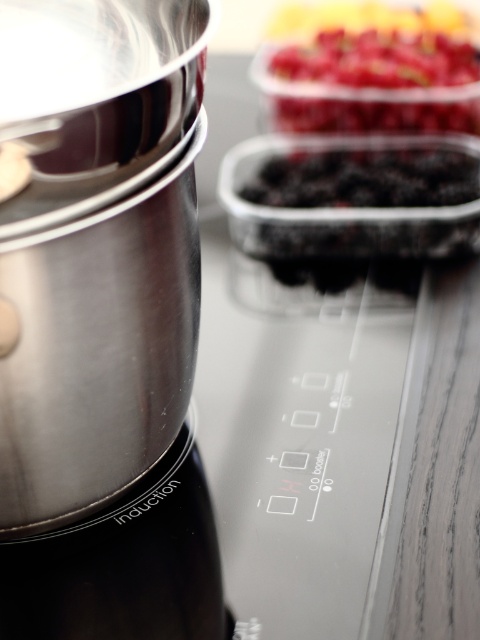
You are a chef preparing a dessert and need to access both the polished metal mixer at left and the glossy plastic berries at upper center. Based on their positions, which object would you need to reach down lower to retrieve?

The polished metal mixer at left is located below the glossy plastic berries at upper center, so you would need to reach down lower to get the polished metal mixer at left.

You are a chef preparing a dessert and need to know which tool to use first. The polished metal mixer at left and the glossy plastic berries at upper center are both on the counter. Which one is larger?

The polished metal mixer at left is bigger than the glossy plastic berries at upper center, so the mixer is larger.

What object is located at the coordinates point (101,323)?

The point (101,323) indicates a polished metal mixer at left.